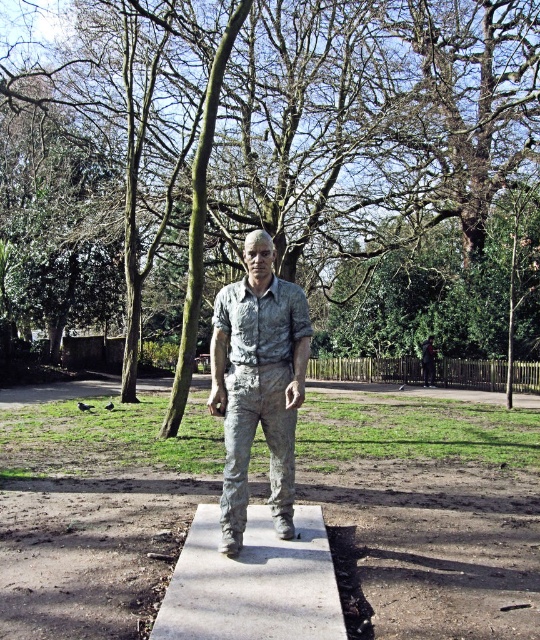
Is green mossy tree at center bigger than bronze statue at center?

Yes, green mossy tree at center is bigger than bronze statue at center.

Between point (249, 86) and point (226, 387), which one is positioned behind?

The point (249, 86) is behind.

Identify the location of green mossy tree at center. (282, 164).

Identify the location of green mossy tree at center. Image resolution: width=540 pixels, height=640 pixels. point(282,164).

Which is in front, point (246, 429) or point (180, 596)?

Point (180, 596)

Can you confirm if bronze statue at center is bigger than concreteroughconcrete at center?

Yes.

Which is behind, point (265, 401) or point (207, 625)?

Point (265, 401)

Image resolution: width=540 pixels, height=640 pixels. What are the coordinates of `bronze statue at center` in the screenshot? It's located at (258, 384).

Who is lower down, concreteroughconcrete at center or matte silver statue at center?

matte silver statue at center

Between concreteroughconcrete at center and matte silver statue at center, which one has more height?

matte silver statue at center

The image size is (540, 640). What do you see at coordinates (253, 582) in the screenshot?
I see `concreteroughconcrete at center` at bounding box center [253, 582].

Find the location of `concreteroughconcrete at center`. concreteroughconcrete at center is located at coordinates (253, 582).